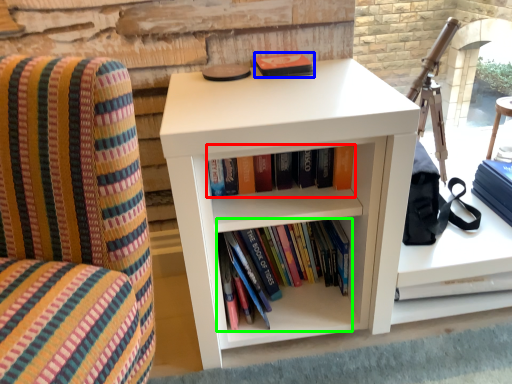
Question: Which object is the farthest from book (highlighted by a red box)? Choose among these: paperback book (highlighted by a blue box) or book (highlighted by a green box).

Choices:
 (A) paperback book
 (B) book

Answer: (A)